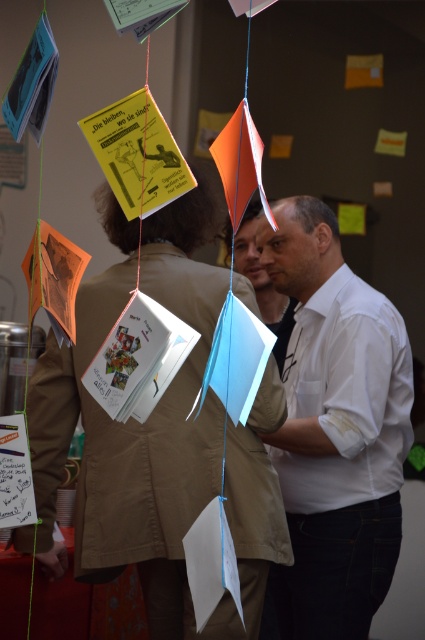
You are standing in the room and want to reach the point at coordinates point [172,616]. If your arm can extend 6 feet, can you reach it?

The point [172,616] is 6.94 feet from the viewer, so your arm can only extend 6 feet, meaning you cannot reach it.

Based on the photo, you are a person who needs to pass between the khaki cotton jacket at center and the white matte shirt at center. The space between them is narrow. Can you fit through the gap? Please provide your reasoning based on the distance provided.

The khaki cotton jacket at center is 16.29 inches from the white matte shirt at center. Since the average human shoulder width is about 18 inches, the gap is narrower than typical shoulder width. Therefore, it would be difficult to comfortably pass through the gap without touching either the khaki cotton jacket at center or the white matte shirt at center.

You are a photographer trying to capture a candid shot of the khaki cotton jacket at center and the white matte shirt at center. Since you want to ensure both subjects are fully visible in the frame, which one should you adjust your camera angle to focus on first, considering their heights?

The khaki cotton jacket at center is shorter than the white matte shirt at center, so you should focus on the khaki cotton jacket at center first to ensure it is fully visible in the frame.